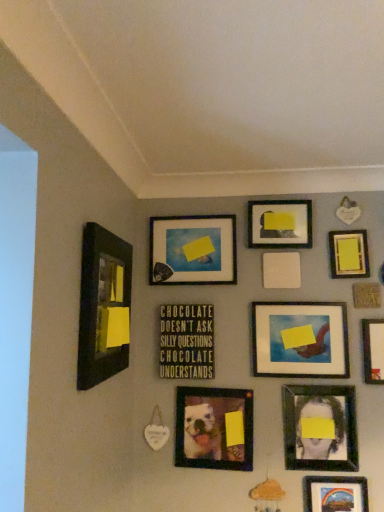
In order to face matte wood picture frame at center, the 3th picture frame positioned from the back, should I rotate leftwards or rightwards?

Rotate right and turn 12.209 degrees.

Describe the element at coordinates (281, 270) in the screenshot. The image size is (384, 512). I see `matte wood picture frame at center, the 9th picture frame when ordered from front to back` at that location.

Locate an element on the screen. Image resolution: width=384 pixels, height=512 pixels. matte black frame at upper center, arranged as the second picture frame when viewed from the back is located at coordinates (280, 224).

Measure the distance between white matte picture frame at upper right, which is counted as the 9th picture frame, starting from the back, and camera.

5.58 feet.

How much space does white matte picture frame at upper right, the 3th picture frame positioned from the front, occupy vertically?

It is 10.06 inches.

What are the coordinates of `matte plastic picture frame at center right, the fifth picture frame from the front` in the screenshot? It's located at (300, 339).

I want to click on matte black frame at center, which is counted as the 11th picture frame, starting from the front, so pos(193,250).

The image size is (384, 512). What do you see at coordinates (193, 250) in the screenshot?
I see `matte black frame at center, which is counted as the 11th picture frame, starting from the front` at bounding box center [193, 250].

The image size is (384, 512). In order to click on metallic rainbow landscape at bottom right, the tenth picture frame positioned from the back in this screenshot , I will do `click(335, 494)`.

Between matte plastic dog portrait at center, the sixth picture frame positioned from the front, and matte black frame at center, which is counted as the first picture frame, starting from the back, which one appears on the right side from the viewer's perspective?

From the viewer's perspective, matte plastic dog portrait at center, the sixth picture frame positioned from the front, appears more on the right side.

Is matte plastic dog portrait at center, the sixth picture frame positioned from the front, not near matte black frame at center, which is counted as the 11th picture frame, starting from the front?

No.

Which is more distant, (251, 412) or (155, 245)?

Point (155, 245)

From a real-world perspective, is matte plastic dog portrait at center, the 6th picture frame from the back, on matte black frame at center, which is counted as the 11th picture frame, starting from the front?

No, from a real-world perspective, matte plastic dog portrait at center, the 6th picture frame from the back, is not over matte black frame at center, which is counted as the 11th picture frame, starting from the front

From the image's perspective, which one is positioned lower, green matte signboard at center, the 8th picture frame in the front-to-back sequence, or matte black picture frame at left, the first picture frame viewed from the front?

green matte signboard at center, the 8th picture frame in the front-to-back sequence, from the image's perspective.

Is matte black picture frame at left, the 11th picture frame in the back-to-front sequence, at the back of green matte signboard at center, the 8th picture frame in the front-to-back sequence?

green matte signboard at center, the 8th picture frame in the front-to-back sequence, is not turned away from matte black picture frame at left, the 11th picture frame in the back-to-front sequence.

From a real-world perspective, is green matte signboard at center, the 8th picture frame in the front-to-back sequence, physically located above or below matte black picture frame at left, the first picture frame viewed from the front?

In terms of real-world spatial position, green matte signboard at center, the 8th picture frame in the front-to-back sequence, is below matte black picture frame at left, the first picture frame viewed from the front.

Who is taller, green matte signboard at center, which is the 4th picture frame from back to front, or matte black picture frame at left, the first picture frame viewed from the front?

With more height is matte black picture frame at left, the first picture frame viewed from the front.

From a real-world perspective, between matte black frame at upper center, arranged as the second picture frame when viewed from the back, and matte plastic dog portrait at center, the 6th picture frame from the back, who is vertically lower?

matte plastic dog portrait at center, the 6th picture frame from the back.

Does matte black frame at upper center, the tenth picture frame from the front, appear on the left side of matte plastic dog portrait at center, the sixth picture frame positioned from the front?

No, matte black frame at upper center, the tenth picture frame from the front, is not to the left of matte plastic dog portrait at center, the sixth picture frame positioned from the front.

Which of these two, matte black frame at upper center, arranged as the second picture frame when viewed from the back, or matte plastic dog portrait at center, the 6th picture frame from the back, is bigger?

With larger size is matte plastic dog portrait at center, the 6th picture frame from the back.

From a real-world perspective, which picture frame is the 2nd one above the matte wood picture frame at center, the 9th picture frame when ordered from front to back? Please provide its 2D coordinates.

[(193, 250)]

Which object is positioned more to the left, matte black frame at center, which is counted as the 11th picture frame, starting from the front, or matte wood picture frame at center, the 3th picture frame positioned from the back?

Positioned to the left is matte black frame at center, which is counted as the 11th picture frame, starting from the front.

Do you think matte black frame at center, which is counted as the 11th picture frame, starting from the front, is within matte wood picture frame at center, the 9th picture frame when ordered from front to back, or outside of it?

matte black frame at center, which is counted as the 11th picture frame, starting from the front, lies outside matte wood picture frame at center, the 9th picture frame when ordered from front to back.

Can you confirm if matte wood picture frame at center, the 3th picture frame positioned from the back, is smaller than matte black frame at center, which is counted as the first picture frame, starting from the back?

Indeed, matte wood picture frame at center, the 3th picture frame positioned from the back, has a smaller size compared to matte black frame at center, which is counted as the first picture frame, starting from the back.

At what (x,y) coordinates should I click in order to perform the action: click on the 2nd picture frame behind the matte wood picture frame at center, the 9th picture frame when ordered from front to back. Please return your answer as a coordinate pair (x, y). The height and width of the screenshot is (512, 384). Looking at the image, I should click on (193, 250).

From the image's perspective, between matte wood picture frame at center, the 9th picture frame when ordered from front to back, and matte black frame at center, which is counted as the 11th picture frame, starting from the front, who is located below?

matte wood picture frame at center, the 9th picture frame when ordered from front to back.

Between matte wood picture frame at center, the 9th picture frame when ordered from front to back, and matte black frame at center, which is counted as the first picture frame, starting from the back, which one is positioned behind?

matte black frame at center, which is counted as the first picture frame, starting from the back, is further away from the camera.

Where is `the 1st picture frame above when counting from the metallic rainbow landscape at bottom right, the tenth picture frame positioned from the back (from the image's perspective)`? This screenshot has height=512, width=384. the 1st picture frame above when counting from the metallic rainbow landscape at bottom right, the tenth picture frame positioned from the back (from the image's perspective) is located at coordinates (212, 428).

Between point (178, 389) and point (360, 479), which one is positioned in front?

Positioned in front is point (360, 479).

From the image's perspective, relative to metallic rainbow landscape at bottom right, arranged as the second picture frame when viewed from the front, is matte plastic dog portrait at center, the 6th picture frame from the back, above or below?

matte plastic dog portrait at center, the 6th picture frame from the back, is situated higher than metallic rainbow landscape at bottom right, arranged as the second picture frame when viewed from the front, in the image.

Based on their positions, is matte plastic dog portrait at center, the 6th picture frame from the back, located to the left or right of metallic rainbow landscape at bottom right, the tenth picture frame positioned from the back?

Clearly, matte plastic dog portrait at center, the 6th picture frame from the back, is on the left of metallic rainbow landscape at bottom right, the tenth picture frame positioned from the back, in the image.

Considering the sizes of objects matte wood picture frame at center, the 9th picture frame when ordered from front to back, and matte plastic picture frame at center right, the 7th picture frame in the back-to-front sequence, in the image provided, who is shorter, matte wood picture frame at center, the 9th picture frame when ordered from front to back, or matte plastic picture frame at center right, the 7th picture frame in the back-to-front sequence,?

matte wood picture frame at center, the 9th picture frame when ordered from front to back, is shorter.

Does matte wood picture frame at center, the 9th picture frame when ordered from front to back, appear on the left side of matte plastic picture frame at center right, the 7th picture frame in the back-to-front sequence?

Indeed, matte wood picture frame at center, the 9th picture frame when ordered from front to back, is positioned on the left side of matte plastic picture frame at center right, the 7th picture frame in the back-to-front sequence.

Can you see matte wood picture frame at center, the 9th picture frame when ordered from front to back, touching matte plastic picture frame at center right, the 7th picture frame in the back-to-front sequence?

No, matte wood picture frame at center, the 9th picture frame when ordered from front to back, is not touching matte plastic picture frame at center right, the 7th picture frame in the back-to-front sequence.

Is matte wood picture frame at center, the 3th picture frame positioned from the back, facing towards matte plastic picture frame at center right, the fifth picture frame from the front?

No, matte wood picture frame at center, the 3th picture frame positioned from the back, does not turn towards matte plastic picture frame at center right, the fifth picture frame from the front.

This screenshot has width=384, height=512. I want to click on picture frame that is the 5th one when counting backward from the matte plastic dog portrait at center, the sixth picture frame positioned from the front, so (x=193, y=250).

Image resolution: width=384 pixels, height=512 pixels. Identify the location of picture frame that is the 2nd object located above the green matte signboard at center, which is the 4th picture frame from back to front (from the image's perspective). (103, 306).

In the scene shown: Which object lies further to the anchor point matte black frame at center, which is counted as the first picture frame, starting from the back, yellow matte picture frame at upper right, positioned as the seventh picture frame in front-to-back order, or green matte signboard at center, the 8th picture frame in the front-to-back sequence?

Based on the image, yellow matte picture frame at upper right, positioned as the seventh picture frame in front-to-back order, appears to be further to matte black frame at center, which is counted as the first picture frame, starting from the back.

In the scene shown: Looking at the image, which one is located further to yellow matte picture frame at upper right, which ranks as the fifth picture frame in back-to-front order, matte black frame at upper center, arranged as the second picture frame when viewed from the back, or matte plastic picture frame at center right, the fifth picture frame from the front?

The object further to yellow matte picture frame at upper right, which ranks as the fifth picture frame in back-to-front order, is matte plastic picture frame at center right, the fifth picture frame from the front.

Looking at the image, which one is located closer to matte plastic dog portrait at center, the sixth picture frame positioned from the front, white matte picture frame at upper right, the 3th picture frame positioned from the front, or matte black portrait at lower right, which is the fourth picture frame in front-to-back order?

Among the two, matte black portrait at lower right, which is the fourth picture frame in front-to-back order, is located nearer to matte plastic dog portrait at center, the sixth picture frame positioned from the front.

Based on their spatial positions, is matte black frame at center, which is counted as the first picture frame, starting from the back, or green matte signboard at center, which is the 4th picture frame from back to front, closer to matte black picture frame at left, the 11th picture frame in the back-to-front sequence?

green matte signboard at center, which is the 4th picture frame from back to front, lies closer to matte black picture frame at left, the 11th picture frame in the back-to-front sequence, than the other object.

Which object lies further to the anchor point matte plastic dog portrait at center, the sixth picture frame positioned from the front, matte black portrait at lower right, which is the fourth picture frame in front-to-back order, or matte wood picture frame at center, the 9th picture frame when ordered from front to back?

matte wood picture frame at center, the 9th picture frame when ordered from front to back.

From the image, which object appears to be nearer to yellow matte picture frame at upper right, which ranks as the fifth picture frame in back-to-front order, matte black portrait at lower right, which is the fourth picture frame in front-to-back order, or matte black frame at center, which is counted as the first picture frame, starting from the back?

matte black frame at center, which is counted as the first picture frame, starting from the back, lies closer to yellow matte picture frame at upper right, which ranks as the fifth picture frame in back-to-front order, than the other object.

Looking at the image, which one is located further to metallic rainbow landscape at bottom right, the tenth picture frame positioned from the back, matte wood picture frame at center, the 3th picture frame positioned from the back, or matte plastic picture frame at center right, the 7th picture frame in the back-to-front sequence?

matte wood picture frame at center, the 3th picture frame positioned from the back, is positioned further to the anchor metallic rainbow landscape at bottom right, the tenth picture frame positioned from the back.

Considering their positions, is matte black frame at center, which is counted as the 11th picture frame, starting from the front, positioned closer to yellow matte picture frame at upper right, which ranks as the fifth picture frame in back-to-front order, than matte plastic picture frame at center right, the fifth picture frame from the front?

matte plastic picture frame at center right, the fifth picture frame from the front.